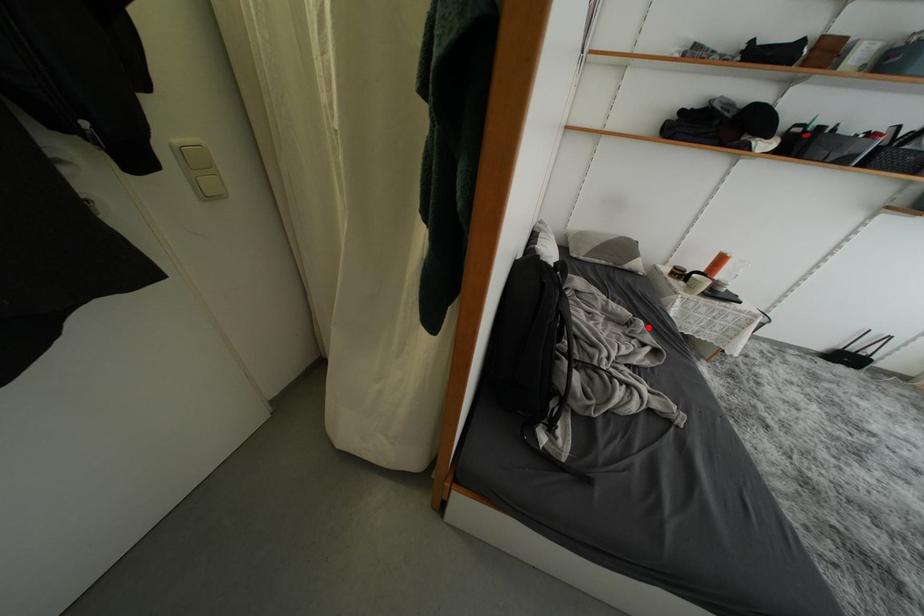
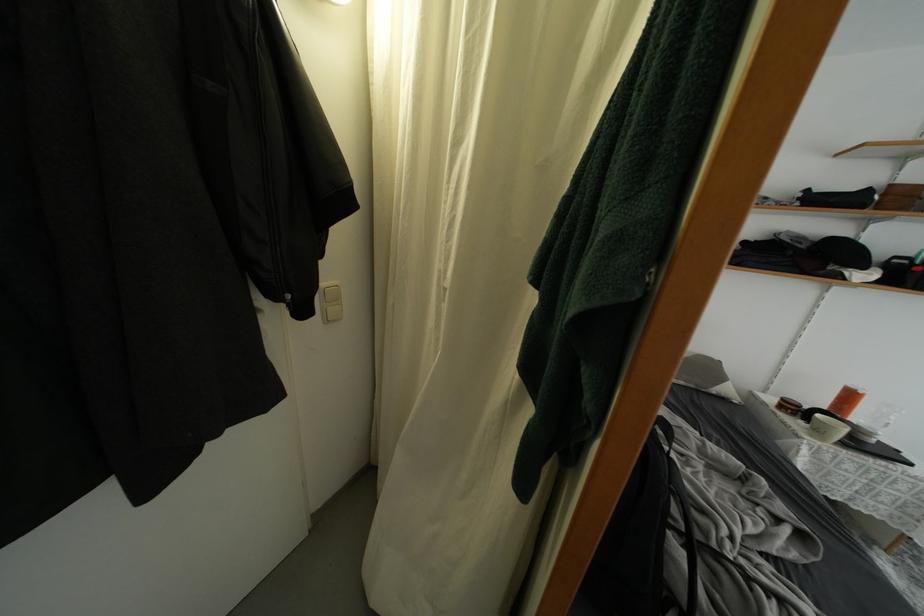
In the second image, find the point that corresponds to the highlighted location in the first image.

(769, 485)